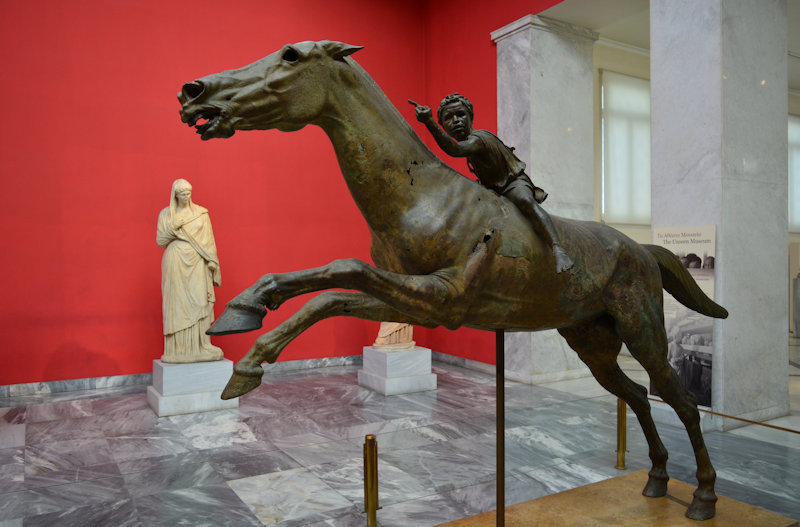
This screenshot has height=527, width=800. What are the coordinates of `window` in the screenshot? It's located at (630, 134).